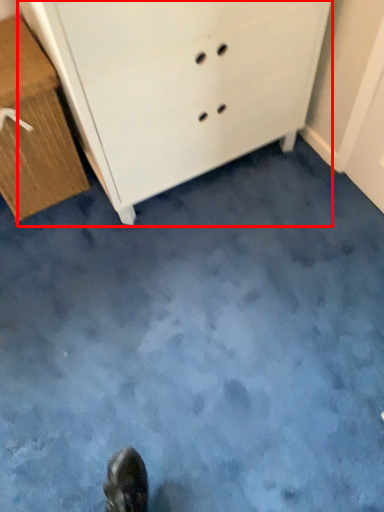
Question: From the image's perspective, what is the correct spatial relationship of chest of drawers (annotated by the red box) in relation to chest of drawers?

Choices:
 (A) above
 (B) below

Answer: (A)